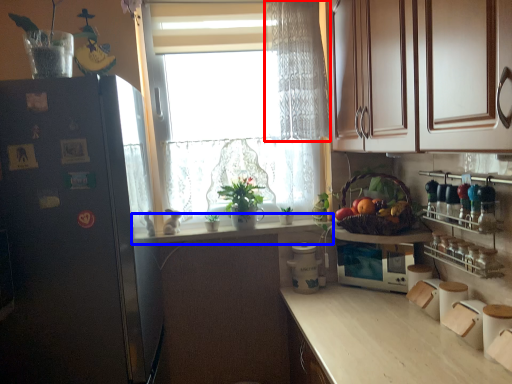
Question: Which point is further to the camera, curtain (highlighted by a red box) or countertop (highlighted by a blue box)?

Choices:
 (A) curtain
 (B) countertop

Answer: (B)